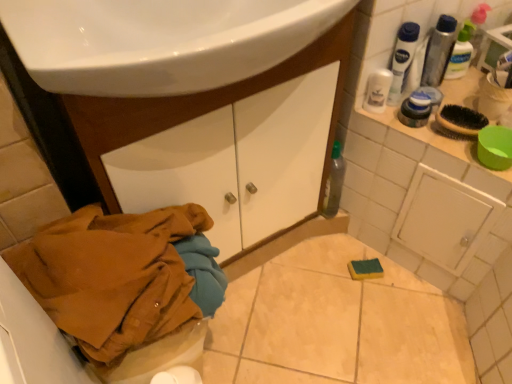
Question: Is white plastic mouthwash at upper right, acting as the 3th mouthwash starting from the right, surrounding brown cotton jacket at lower left?

Choices:
 (A) no
 (B) yes

Answer: (A)

Question: From a real-world perspective, is white plastic mouthwash at upper right, acting as the 3th mouthwash starting from the right, over brown cotton jacket at lower left?

Choices:
 (A) no
 (B) yes

Answer: (B)

Question: Is white plastic mouthwash at upper right, acting as the 3th mouthwash starting from the right, smaller than brown cotton jacket at lower left?

Choices:
 (A) yes
 (B) no

Answer: (A)

Question: Is there a large distance between white plastic mouthwash at upper right, which is the 2th mouthwash from left to right, and brown cotton jacket at lower left?

Choices:
 (A) no
 (B) yes

Answer: (A)

Question: Is the position of white plastic mouthwash at upper right, acting as the 3th mouthwash starting from the right, more distant than that of brown cotton jacket at lower left?

Choices:
 (A) yes
 (B) no

Answer: (A)

Question: Is white plastic mouthwash at upper right, acting as the 3th mouthwash starting from the right, at the left side of brown cotton jacket at lower left?

Choices:
 (A) yes
 (B) no

Answer: (B)

Question: Is white plastic mouthwash at upper right, marked as the first mouthwash in a left-to-right arrangement, far from matte black shaving cream at upper right?

Choices:
 (A) yes
 (B) no

Answer: (B)

Question: Can you confirm if white plastic mouthwash at upper right, marked as the first mouthwash in a left-to-right arrangement, is shorter than matte black shaving cream at upper right?

Choices:
 (A) no
 (B) yes

Answer: (A)

Question: Are white plastic mouthwash at upper right, acting as the 4th mouthwash starting from the right, and matte black shaving cream at upper right making contact?

Choices:
 (A) yes
 (B) no

Answer: (A)

Question: Considering the relative positions of white plastic mouthwash at upper right, marked as the first mouthwash in a left-to-right arrangement, and matte black shaving cream at upper right in the image provided, is white plastic mouthwash at upper right, marked as the first mouthwash in a left-to-right arrangement, to the left of matte black shaving cream at upper right from the viewer's perspective?

Choices:
 (A) no
 (B) yes

Answer: (B)

Question: Is white plastic mouthwash at upper right, acting as the 4th mouthwash starting from the right, to the right of matte black shaving cream at upper right from the viewer's perspective?

Choices:
 (A) no
 (B) yes

Answer: (A)

Question: From the image's perspective, does white plastic mouthwash at upper right, acting as the 4th mouthwash starting from the right, appear higher than matte black shaving cream at upper right?

Choices:
 (A) no
 (B) yes

Answer: (B)

Question: Is translucent plastic mouthwash at upper right, the third mouthwash positioned from the left, at the right side of brown cotton jacket at lower left?

Choices:
 (A) yes
 (B) no

Answer: (A)